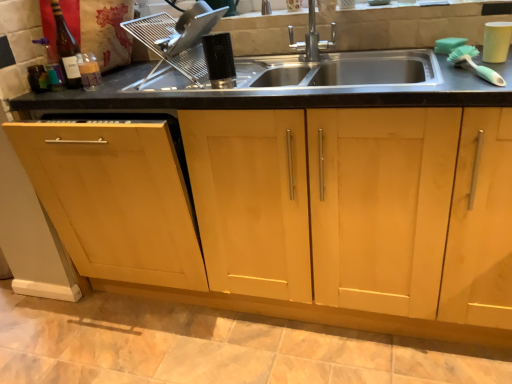
Identify the location of spots to the right of translucent glass bottle at upper left. The width and height of the screenshot is (512, 384). (132, 81).